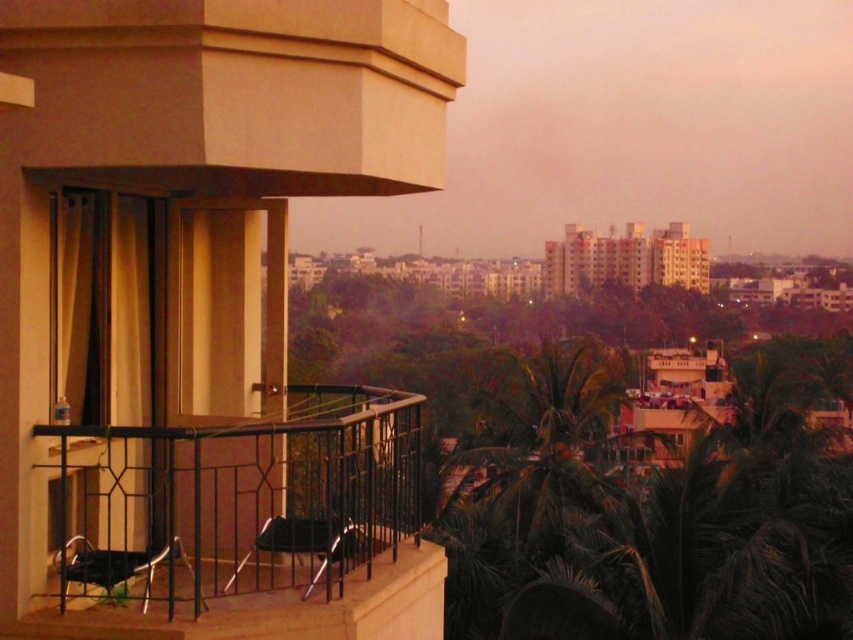
Can you confirm if matte black balcony at center is positioned above black plastic chair at lower left?

Indeed, matte black balcony at center is positioned over black plastic chair at lower left.

Can you confirm if matte black balcony at center is thinner than black plastic chair at lower left?

No, matte black balcony at center is not thinner than black plastic chair at lower left.

Which is in front, point (422, 32) or point (83, 568)?

Point (83, 568)

Image resolution: width=853 pixels, height=640 pixels. I want to click on matte black balcony at center, so click(198, 177).

Measure the distance between matte black balcony at center and black metal railing at lower left.

matte black balcony at center and black metal railing at lower left are 38.20 inches apart from each other.

Is point (30, 470) positioned after point (120, 458)?

That is False.

Where is `matte black balcony at center`? Image resolution: width=853 pixels, height=640 pixels. matte black balcony at center is located at coordinates (198, 177).

From the picture: Can you confirm if matte black balcony at center is shorter than metallic black chair at center?

No.

Describe the element at coordinates (198, 177) in the screenshot. I see `matte black balcony at center` at that location.

The width and height of the screenshot is (853, 640). Find the location of `matte black balcony at center`. matte black balcony at center is located at coordinates (198, 177).